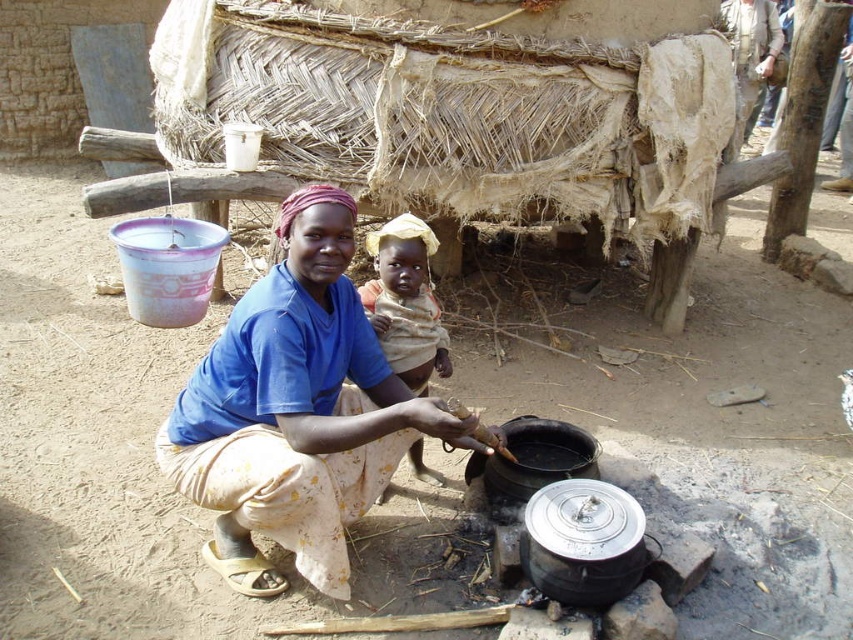
From the picture: Is blue fabric at center to the left of light brown fabric baby at center from the viewer's perspective?

Correct, you'll find blue fabric at center to the left of light brown fabric baby at center.

Who is positioned more to the left, blue fabric at center or light brown fabric baby at center?

blue fabric at center

Identify the location of blue fabric at center. The width and height of the screenshot is (853, 640). (296, 412).

Where is `blue fabric at center`? The width and height of the screenshot is (853, 640). blue fabric at center is located at coordinates (296, 412).